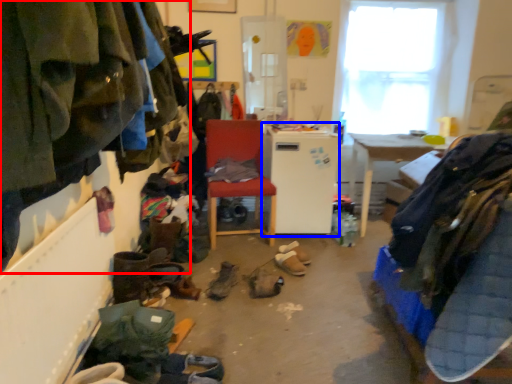
Question: Which of the following is the closest to the observer, clothing (highlighted by a red box) or appliance (highlighted by a blue box)?

Choices:
 (A) clothing
 (B) appliance

Answer: (A)